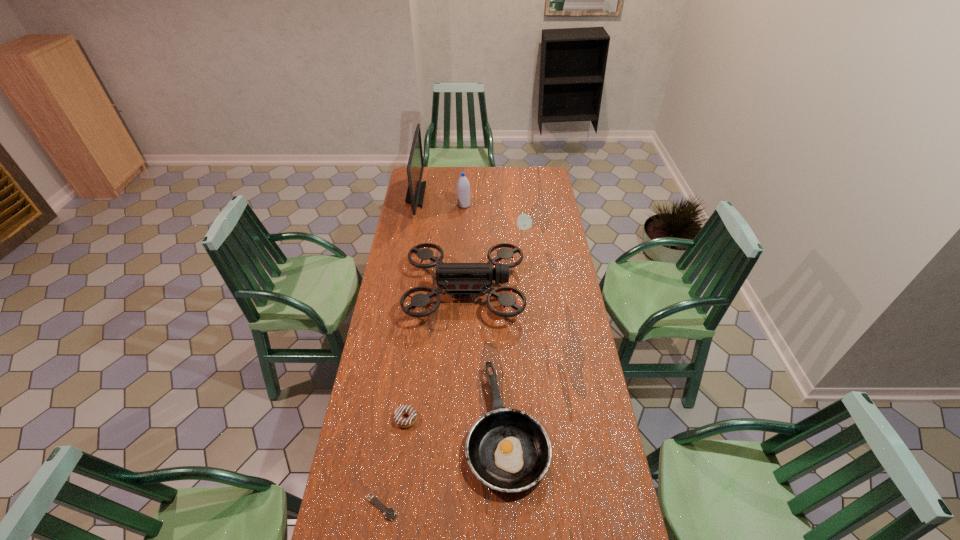
I want to click on free space located on the right of the second tallest object, so click(484, 205).

I want to click on vacant position located on the front-facing side of the third tallest object, so click(x=563, y=291).

I want to click on vacant space located 0.380m on the left of the apple, so click(x=446, y=228).

Where is `free location located on the back of the frying pan`? This screenshot has width=960, height=540. free location located on the back of the frying pan is located at coordinates (501, 300).

This screenshot has width=960, height=540. What are the coordinates of `vacant region located 0.120m on the left of the doughnut` in the screenshot? It's located at (362, 418).

Where is `blank space located on the back of the watch`? The image size is (960, 540). blank space located on the back of the watch is located at coordinates pos(396,403).

The height and width of the screenshot is (540, 960). I want to click on object that is at the far edge, so click(x=416, y=189).

The height and width of the screenshot is (540, 960). What are the coordinates of `monitor that is at the left edge` in the screenshot? It's located at (416, 189).

The image size is (960, 540). What are the coordinates of `drone located in the left edge section of the desktop` in the screenshot? It's located at (456, 278).

Where is `doughnut that is at the left edge`? This screenshot has height=540, width=960. doughnut that is at the left edge is located at coordinates (404, 409).